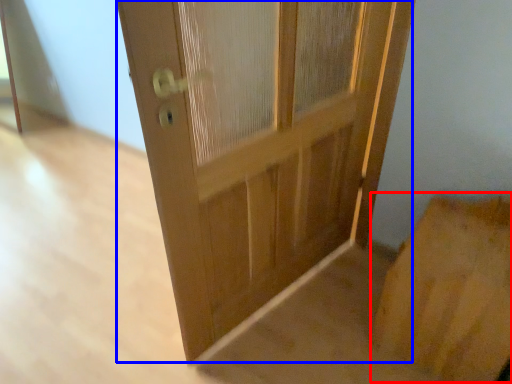
Question: Which object appears closest to the camera in this image, cardboard box (highlighted by a red box) or door (highlighted by a blue box)?

Choices:
 (A) cardboard box
 (B) door

Answer: (B)